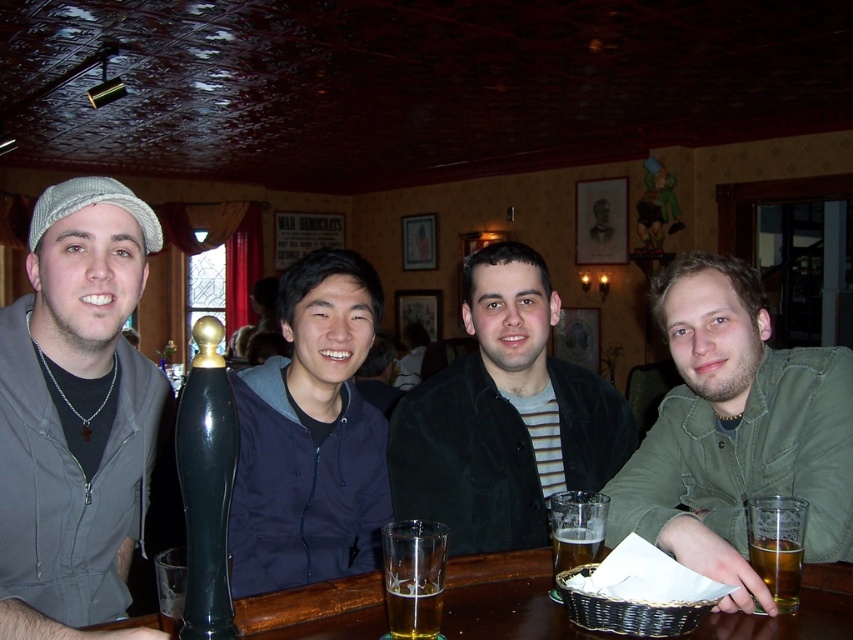
Question: Is matte gray cap at left to the right of dark green jacket at center from the viewer's perspective?

Choices:
 (A) yes
 (B) no

Answer: (B)

Question: Which of the following is the farthest from the observer?

Choices:
 (A) (387, 582)
 (B) (844, 573)
 (C) (717, 408)

Answer: (C)

Question: Which of the following is the closest to the observer?

Choices:
 (A) (392, 600)
 (B) (807, 419)
 (C) (83, 380)
 (D) (788, 577)

Answer: (A)

Question: Which object is the closest to the matte gray cap at left?

Choices:
 (A) golden glass beer at bar
 (B) dark green jacket at center
 (C) brown wooden table at lower center
 (D) navy blue jacket at center

Answer: (D)

Question: Can you confirm if matte gray cap at left is bigger than golden amber liquid at lower right?

Choices:
 (A) no
 (B) yes

Answer: (B)

Question: Does matte gray cap at left appear over brown wooden table at lower center?

Choices:
 (A) yes
 (B) no

Answer: (A)